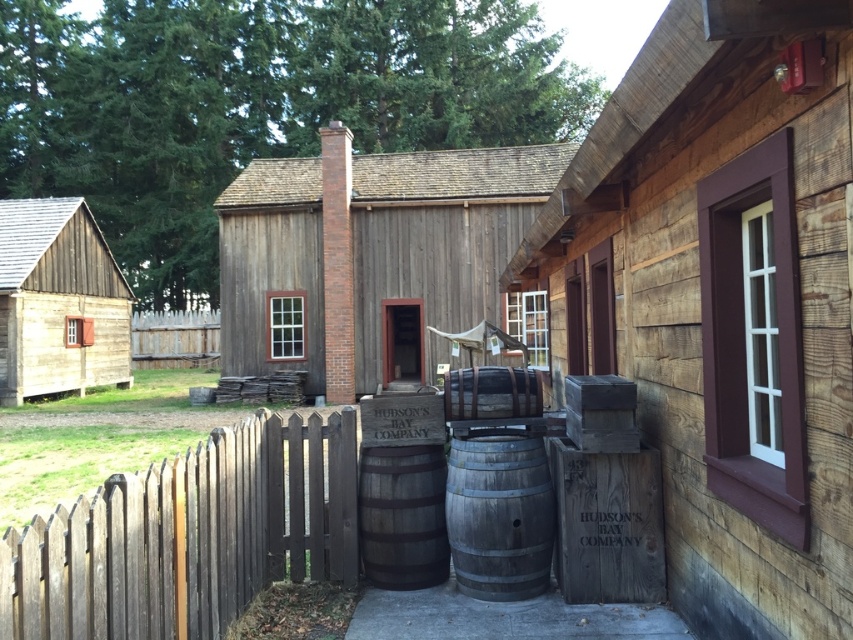
Question: Can you confirm if rustic wooden barrel at center is positioned to the left of wooden barrel at center?

Choices:
 (A) no
 (B) yes

Answer: (B)

Question: Does wooden crate at center have a smaller size compared to brown wooden fence at lower left?

Choices:
 (A) no
 (B) yes

Answer: (A)

Question: Estimate the real-world distances between objects in this image. Which object is closer to the brown wooden fence at lower left?

Choices:
 (A) wooden picket fence at center
 (B) wooden crate at center
 (C) gray wooden barrel at center
 (D) rustic wooden barrel at center

Answer: (D)

Question: Is wooden crate at center above brown wooden fence at lower left?

Choices:
 (A) yes
 (B) no

Answer: (A)

Question: Considering the real-world distances, which object is closest to the wooden cabin at left?

Choices:
 (A) wooden barrel at center
 (B) wooden cabin at center
 (C) brown wooden fence at lower left
 (D) wooden picket fence at center

Answer: (B)

Question: Which point is farther to the camera?

Choices:
 (A) wooden crate at center
 (B) wooden cabin at center

Answer: (B)